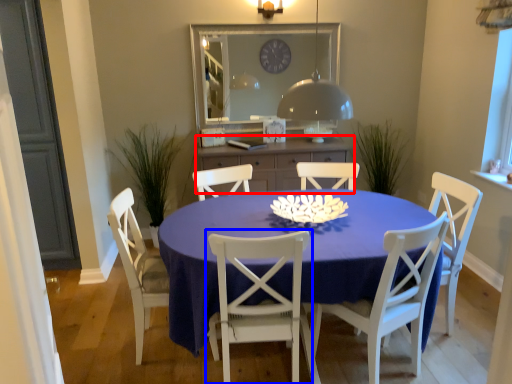
Question: Which of the following is the closest to the observer, cabinetry (highlighted by a red box) or chair (highlighted by a blue box)?

Choices:
 (A) cabinetry
 (B) chair

Answer: (B)